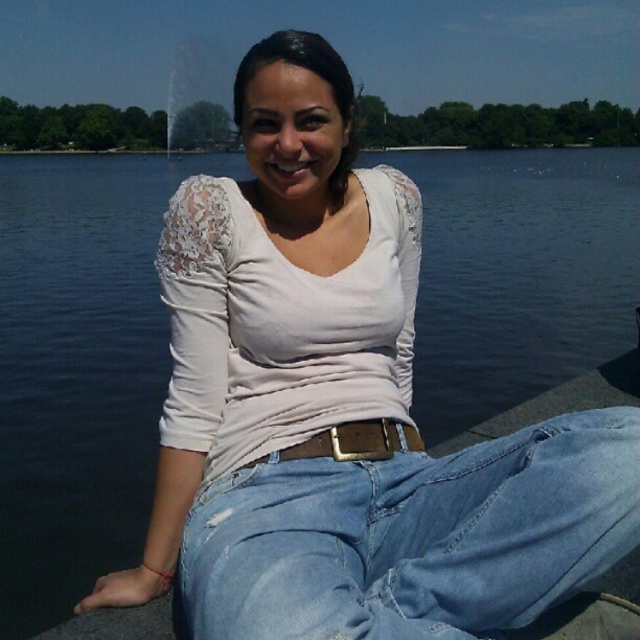
Question: In this image, where is denim jeans at lower center located relative to brown leather belt at center?

Choices:
 (A) below
 (B) above

Answer: (A)

Question: Which of the following is the farthest from the observer?

Choices:
 (A) denim jeans at lower center
 (B) brown leather belt at center

Answer: (B)

Question: Does denim jeans at lower center have a greater width compared to brown leather belt at center?

Choices:
 (A) no
 (B) yes

Answer: (B)

Question: Considering the relative positions of denim jeans at lower center and brown leather belt at center in the image provided, where is denim jeans at lower center located with respect to brown leather belt at center?

Choices:
 (A) below
 (B) above

Answer: (A)

Question: Which of the following is the farthest from the observer?

Choices:
 (A) brown leather belt at center
 (B) denim jeans at lower center

Answer: (A)